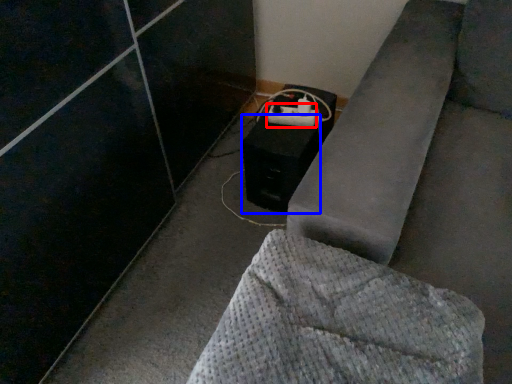
Question: Which of the following is the closest to the observer, extension cord (highlighted by a red box) or speaker (highlighted by a blue box)?

Choices:
 (A) extension cord
 (B) speaker

Answer: (B)